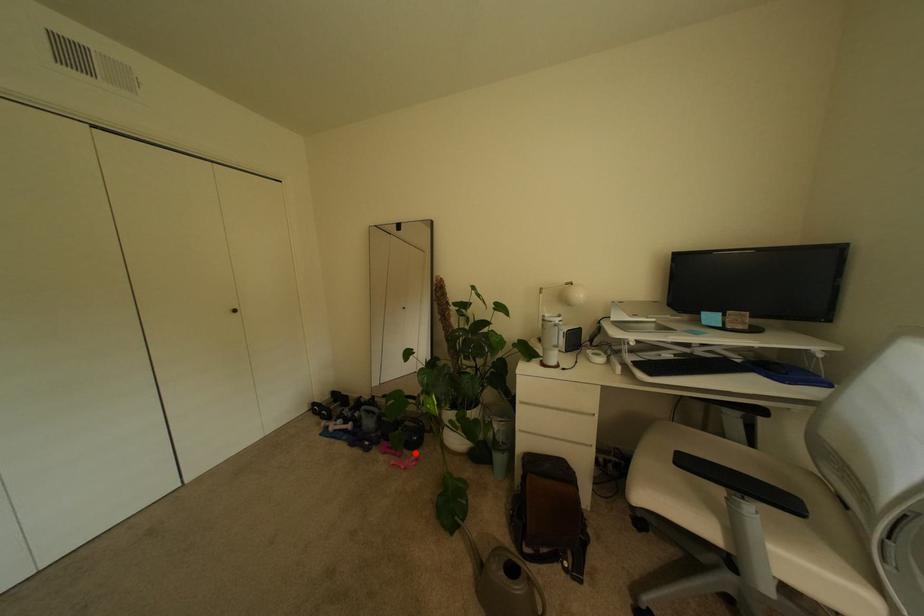
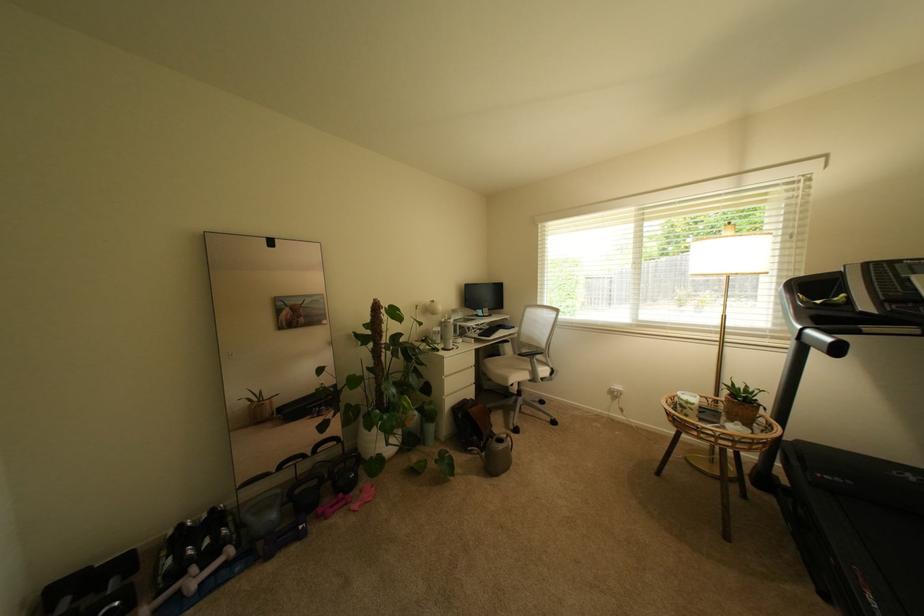
Question: I am providing you with two images of the same scene from different viewpoints. Image1 has a red point marked. In image2, the corresponding 3D location appears at what relative position? Reply with the corresponding letter.

Choices:
 (A) Closer
 (B) Farther

Answer: (B)